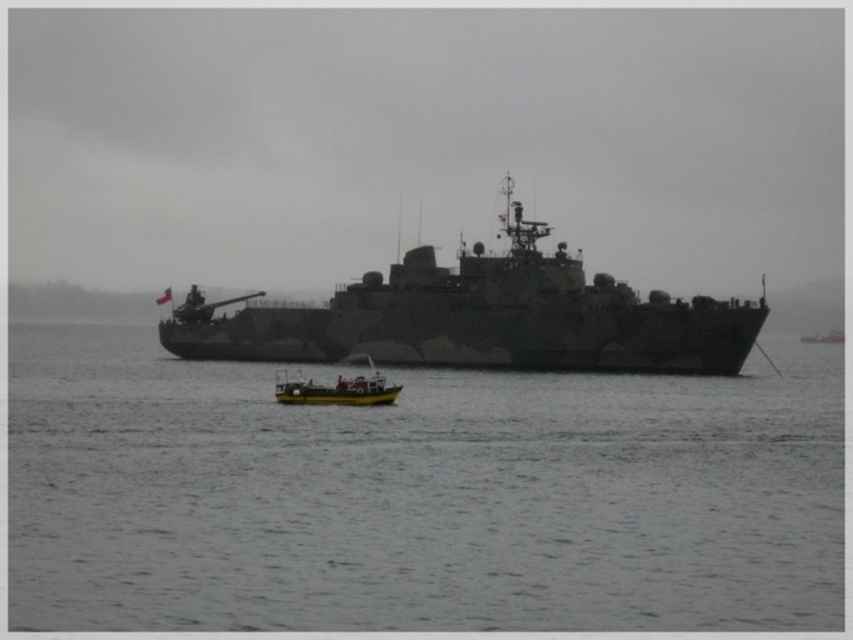
You are a drone operator tasked with guiding a drone from the smaller yellow and white boat to the camouflage matte ship at center. Given the coordinates provided in the Objects Description, can you determine if the drone can reach the ship directly without any obstacles?

The camouflage matte ship at center is located at point (480, 317), so yes, the drone can reach the ship directly as the coordinates indicate its exact position, assuming no physical barriers exist between the two points.